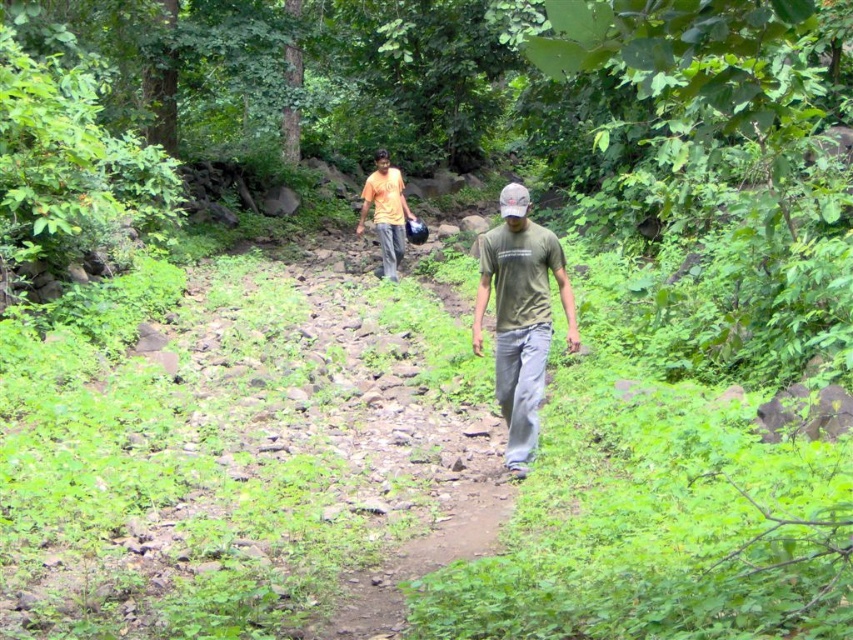
Who is more distant from viewer, (531, 442) or (381, 189)?

The point (381, 189) is more distant.

Can you confirm if green matte t-shirt at center is bigger than orange matte shirt at center?

Yes, green matte t-shirt at center is bigger than orange matte shirt at center.

This screenshot has height=640, width=853. Describe the element at coordinates (520, 316) in the screenshot. I see `green matte t-shirt at center` at that location.

You are a GUI agent. You are given a task and a screenshot of the screen. Output one action in this format:
    pyautogui.click(x=<x>, y=<y>)
    Task: Click on the green matte t-shirt at center
    
    Given the screenshot: What is the action you would take?
    pyautogui.click(x=520, y=316)